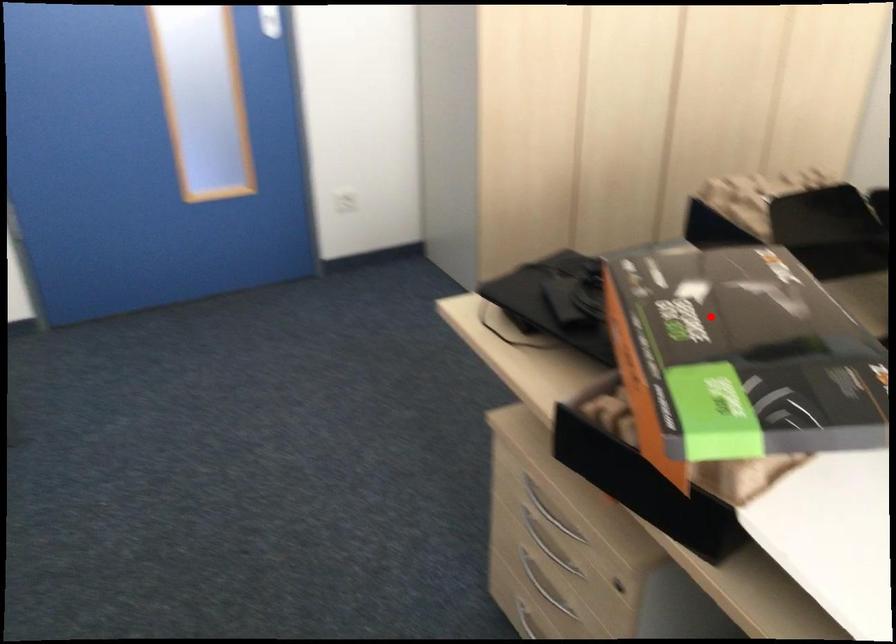
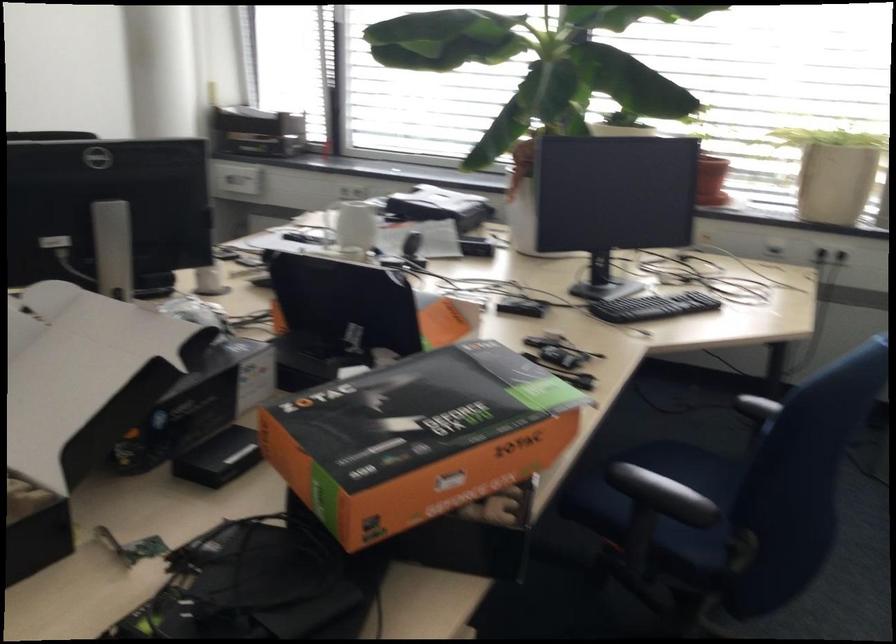
In the second image, find the point that corresponds to the highlighted location in the first image.

(399, 421)